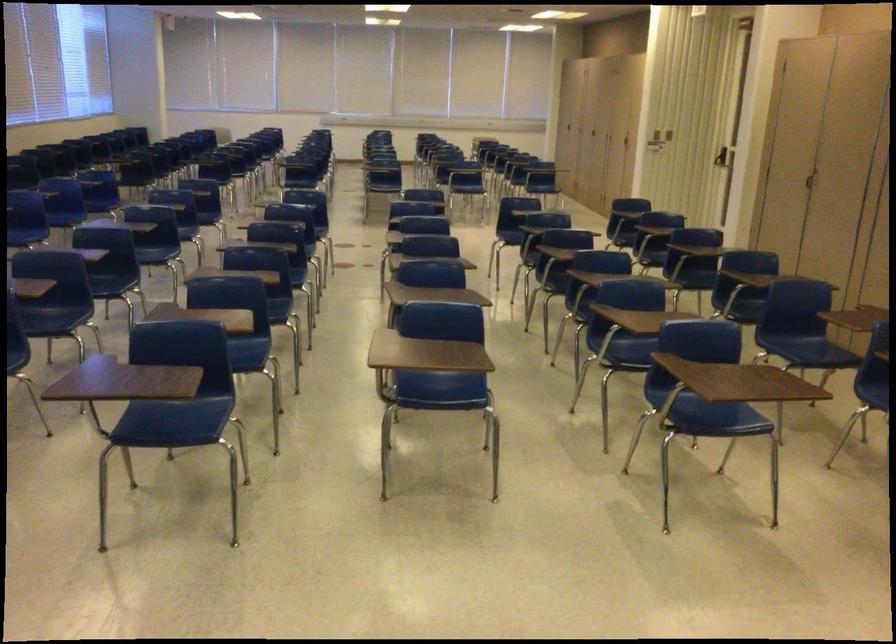
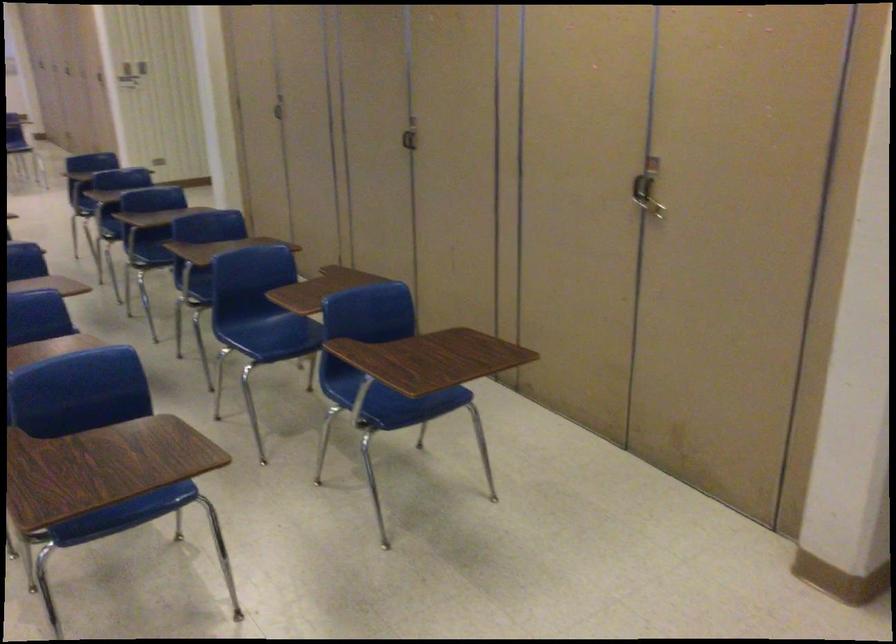
Locate, in the second image, the point that corresponds to [811,174] in the first image.

(279, 107)